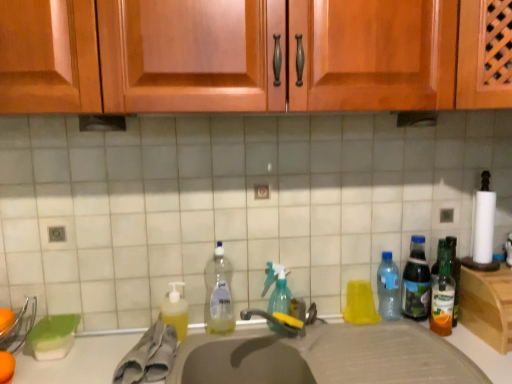
Question: Is transparent plastic bottle at right, placed as the third bottle when sorted from right to left, positioned with its back to green glass bottle at right?

Choices:
 (A) yes
 (B) no

Answer: (B)

Question: Can you confirm if transparent plastic bottle at right, which is the third bottle from left to right, is smaller than green glass bottle at right?

Choices:
 (A) no
 (B) yes

Answer: (B)

Question: Could you tell me if transparent plastic bottle at right, placed as the third bottle when sorted from right to left, is facing green glass bottle at right?

Choices:
 (A) no
 (B) yes

Answer: (A)

Question: Is transparent plastic bottle at right, which is the third bottle from left to right, further to the viewer compared to green glass bottle at right?

Choices:
 (A) yes
 (B) no

Answer: (A)

Question: From the image's perspective, is transparent plastic bottle at right, placed as the third bottle when sorted from right to left, located beneath green glass bottle at right?

Choices:
 (A) no
 (B) yes

Answer: (A)

Question: Considering the relative sizes of transparent plastic bottle at right, which is the third bottle from left to right, and green glass bottle at right in the image provided, is transparent plastic bottle at right, which is the third bottle from left to right, thinner than green glass bottle at right?

Choices:
 (A) yes
 (B) no

Answer: (A)

Question: Is gray matte sink at center thinner than translucent plastic spray bottle at center, the 2th bottle viewed from the left?

Choices:
 (A) yes
 (B) no

Answer: (B)

Question: From the image's perspective, is gray matte sink at center below translucent plastic spray bottle at center, the fourth bottle viewed from the right?

Choices:
 (A) no
 (B) yes

Answer: (B)

Question: Considering the relative sizes of gray matte sink at center and translucent plastic spray bottle at center, the 2th bottle viewed from the left, in the image provided, is gray matte sink at center taller than translucent plastic spray bottle at center, the 2th bottle viewed from the left,?

Choices:
 (A) yes
 (B) no

Answer: (A)

Question: From a real-world perspective, is gray matte sink at center below translucent plastic spray bottle at center, the 2th bottle viewed from the left?

Choices:
 (A) yes
 (B) no

Answer: (A)

Question: Considering the relative positions of gray matte sink at center and translucent plastic spray bottle at center, the fourth bottle viewed from the right, in the image provided, is gray matte sink at center to the right of translucent plastic spray bottle at center, the fourth bottle viewed from the right, from the viewer's perspective?

Choices:
 (A) yes
 (B) no

Answer: (A)

Question: Considering the relative sizes of gray matte sink at center and translucent plastic spray bottle at center, the fourth bottle viewed from the right, in the image provided, is gray matte sink at center smaller than translucent plastic spray bottle at center, the fourth bottle viewed from the right,?

Choices:
 (A) no
 (B) yes

Answer: (A)

Question: Is translucent plastic bottle at right, the second bottle when ordered from right to left, outside clear plastic bottle at center, the first bottle from the left?

Choices:
 (A) no
 (B) yes

Answer: (B)